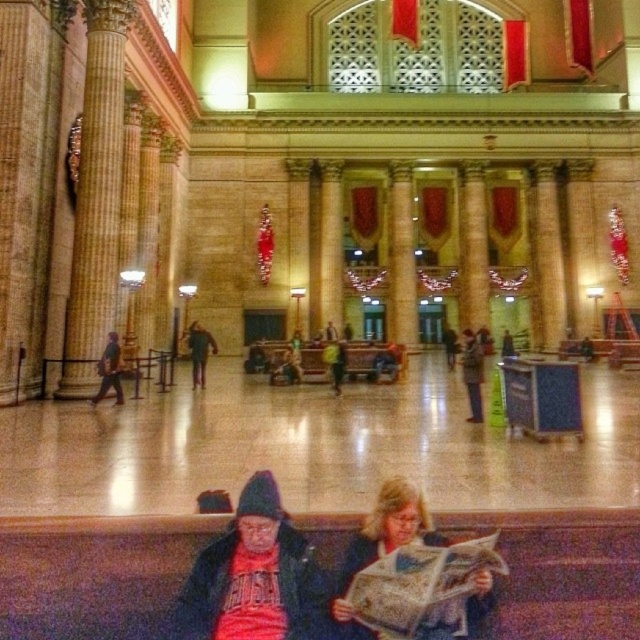
Consider the image. Who is taller, matte red shirt at lower center or dark brown leather jacket at center?

dark brown leather jacket at center is taller.

Can you confirm if matte red shirt at lower center is shorter than dark brown leather jacket at center?

Correct, matte red shirt at lower center is not as tall as dark brown leather jacket at center.

Is point (273, 564) less distant than point (202, 378)?

That is True.

The width and height of the screenshot is (640, 640). What are the coordinates of `matte red shirt at lower center` in the screenshot? It's located at (253, 577).

Who is positioned more to the left, matte red shirt at lower center or matte black jacket at lower center?

matte red shirt at lower center

Measure the distance between matte red shirt at lower center and camera.

They are 19.40 meters apart.

Who is more distant from viewer, [221,632] or [458,636]?

The point [221,632] is more distant.

Identify the location of matte red shirt at lower center. (253, 577).

Is point (268, 472) positioned after point (211, 336)?

No, (268, 472) is closer to viewer.

Is red knit cap at lower center thinner than dark brown leather jacket at center?

Incorrect, red knit cap at lower center's width is not less than dark brown leather jacket at center's.

Image resolution: width=640 pixels, height=640 pixels. I want to click on red knit cap at lower center, so click(284, 572).